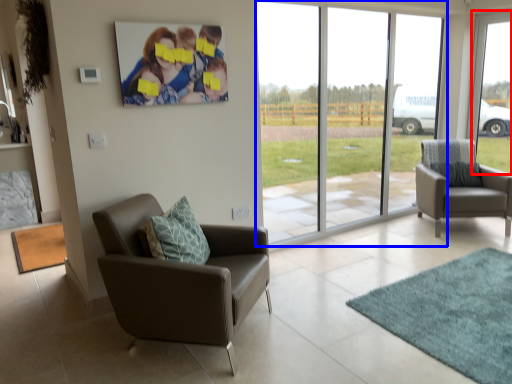
Question: Which of the following is the closest to the observer, window (highlighted by a red box) or window (highlighted by a blue box)?

Choices:
 (A) window
 (B) window

Answer: (B)